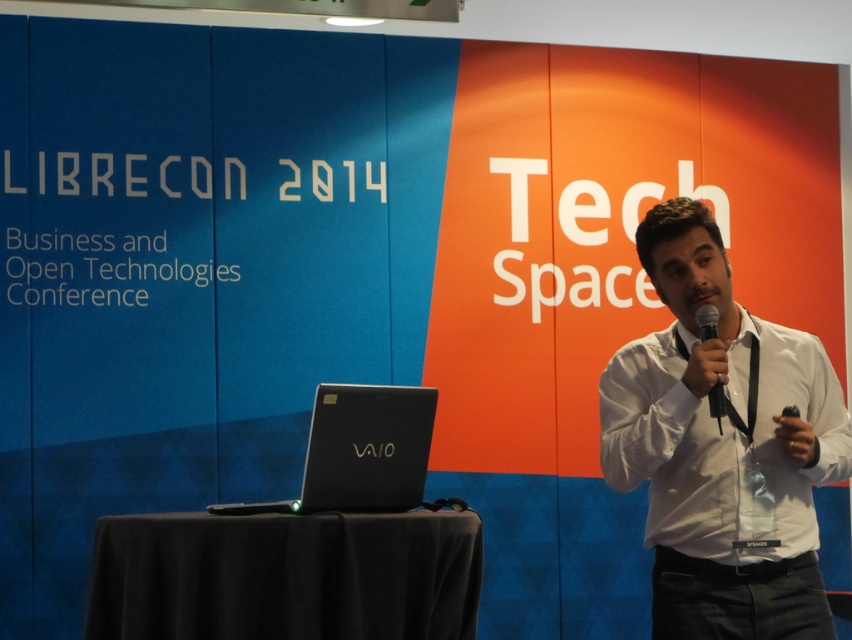
Who is taller, white shirt at center or black metallic microphone at center?

white shirt at center is taller.

Measure the distance between white shirt at center and camera.

white shirt at center and camera are 7.73 feet apart from each other.

I want to click on white shirt at center, so click(721, 445).

Does white shirt at center have a smaller size compared to black matte vaio at lower left?

Actually, white shirt at center might be larger than black matte vaio at lower left.

The width and height of the screenshot is (852, 640). Find the location of `white shirt at center`. white shirt at center is located at coordinates (721, 445).

The image size is (852, 640). In order to click on white shirt at center in this screenshot , I will do `click(721, 445)`.

Does black matte vaio at lower left have a lesser width compared to black metallic microphone at center?

No.

Who is taller, black matte vaio at lower left or black metallic microphone at center?

black matte vaio at lower left is taller.

You are a GUI agent. You are given a task and a screenshot of the screen. Output one action in this format:
    pyautogui.click(x=<x>, y=<y>)
    Task: Click on the black matte vaio at lower left
    
    Given the screenshot: What is the action you would take?
    pyautogui.click(x=360, y=451)

Image resolution: width=852 pixels, height=640 pixels. I want to click on black matte vaio at lower left, so click(x=360, y=451).